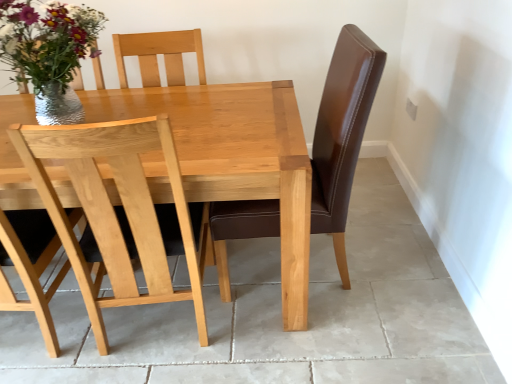
Image resolution: width=512 pixels, height=384 pixels. I want to click on vacant space to the right of light wood chair at center, so point(263,315).